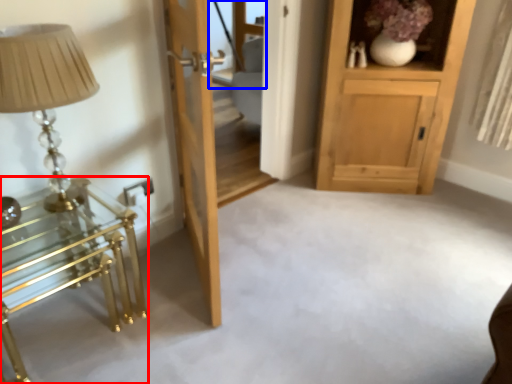
Question: Which point is closer to the camera, table (highlighted by a red box) or glass door (highlighted by a blue box)?

Choices:
 (A) table
 (B) glass door

Answer: (A)